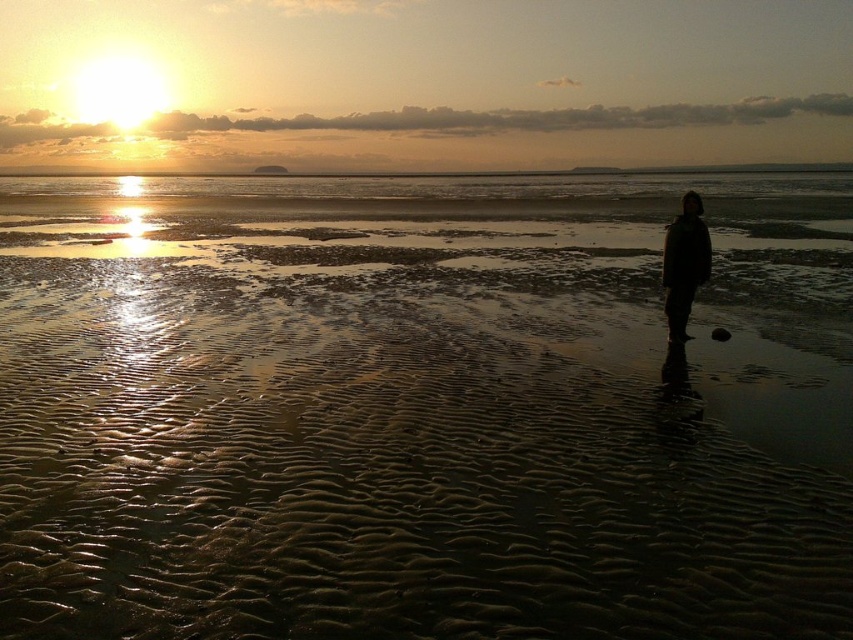
Question: Among these objects, which one is nearest to the camera?

Choices:
 (A) wet sand at center
 (B) black matte coat at center

Answer: (A)

Question: Does wet sand at center have a greater width compared to black matte coat at center?

Choices:
 (A) no
 (B) yes

Answer: (B)

Question: Is wet sand at center thinner than black matte coat at center?

Choices:
 (A) no
 (B) yes

Answer: (A)

Question: In this image, where is wet sand at center located relative to black matte coat at center?

Choices:
 (A) right
 (B) left

Answer: (B)

Question: Which object is closer to the camera taking this photo?

Choices:
 (A) wet sand at center
 (B) black matte coat at center

Answer: (A)